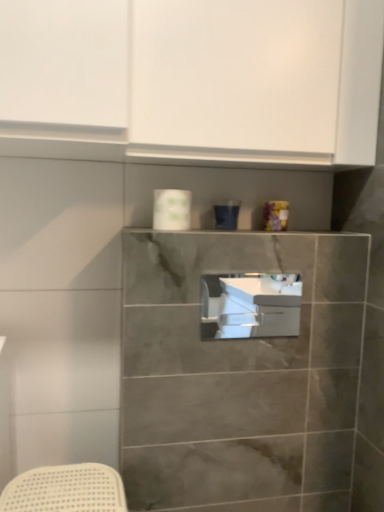
Question: Is white glossy sink at center to the right of white glossy toilet paper at upper center from the viewer's perspective?

Choices:
 (A) no
 (B) yes

Answer: (B)

Question: Is white glossy sink at center not close to white glossy toilet paper at upper center?

Choices:
 (A) no
 (B) yes

Answer: (A)

Question: Is white glossy sink at center not inside white glossy toilet paper at upper center?

Choices:
 (A) no
 (B) yes

Answer: (B)

Question: From a real-world perspective, is white glossy sink at center on white glossy toilet paper at upper center?

Choices:
 (A) no
 (B) yes

Answer: (A)

Question: Is white glossy sink at center thinner than white glossy toilet paper at upper center?

Choices:
 (A) no
 (B) yes

Answer: (B)

Question: From the image's perspective, would you say white glossy sink at center is shown under white glossy toilet paper at upper center?

Choices:
 (A) no
 (B) yes

Answer: (B)

Question: Considering the relative sizes of white glossy sink at center and white matte cabinet at upper center in the image provided, is white glossy sink at center wider than white matte cabinet at upper center?

Choices:
 (A) yes
 (B) no

Answer: (B)

Question: Is white glossy sink at center smaller than white matte cabinet at upper center?

Choices:
 (A) yes
 (B) no

Answer: (A)

Question: Is white glossy sink at center looking in the opposite direction of white matte cabinet at upper center?

Choices:
 (A) no
 (B) yes

Answer: (A)

Question: From a real-world perspective, is white glossy sink at center below white matte cabinet at upper center?

Choices:
 (A) yes
 (B) no

Answer: (A)

Question: Does white glossy sink at center have a larger size compared to white matte cabinet at upper center?

Choices:
 (A) yes
 (B) no

Answer: (B)

Question: Is white glossy sink at center closer to camera compared to white matte cabinet at upper center?

Choices:
 (A) no
 (B) yes

Answer: (A)

Question: Is white matte cabinet at upper center wider than white glossy toilet paper at upper center?

Choices:
 (A) no
 (B) yes

Answer: (B)